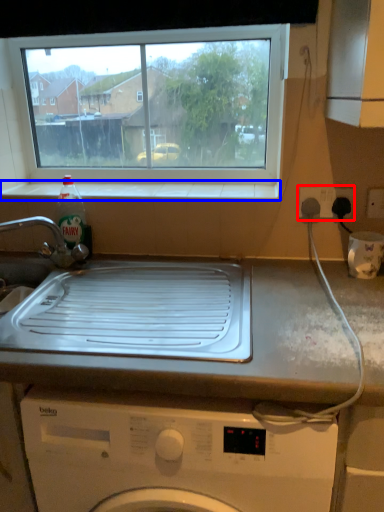
Question: Which of the following is the farthest to the observer, electric outlet (highlighted by a red box) or window sill (highlighted by a blue box)?

Choices:
 (A) electric outlet
 (B) window sill

Answer: (B)